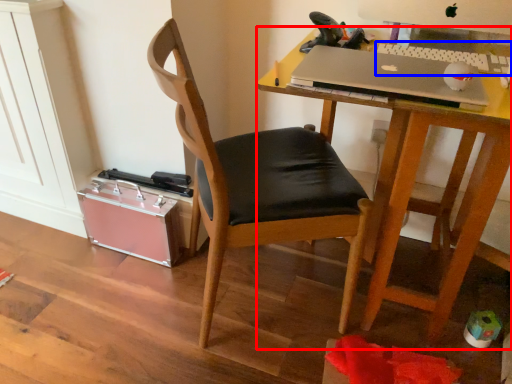
Question: Among these objects, which one is nearest to the camera, desk (highlighted by a red box) or laptop keyboard (highlighted by a blue box)?

Choices:
 (A) desk
 (B) laptop keyboard

Answer: (A)